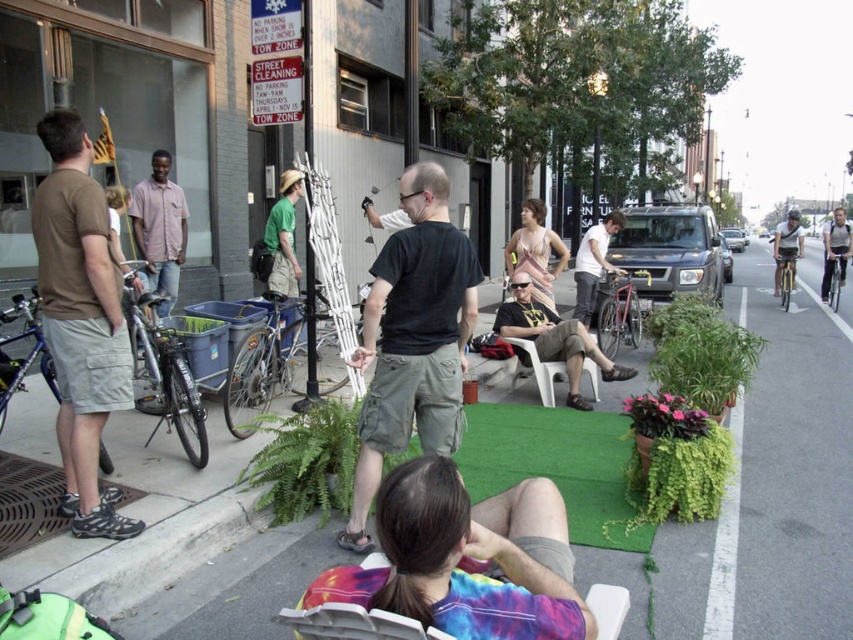
Question: Estimate the real-world distances between objects in this image. Which object is closer to the pink shirt at center?

Choices:
 (A) matte black t-shirt at center
 (B) white plastic chair at center
 (C) brown cotton t-shirt at left

Answer: (C)

Question: Can you confirm if green artificial turf at center is thinner than black cotton shirt at center?

Choices:
 (A) yes
 (B) no

Answer: (B)

Question: Which object is the farthest from the green artificial turf at center?

Choices:
 (A) black cotton shirt at center
 (B) tie-dye fabric at lower center

Answer: (A)

Question: Considering the relative positions of black cotton shirt at center and brown cotton t-shirt at left in the image provided, where is black cotton shirt at center located with respect to brown cotton t-shirt at left?

Choices:
 (A) below
 (B) above

Answer: (A)

Question: Which object is farther from the camera taking this photo?

Choices:
 (A) green artificial turf at center
 (B) light blue jeans at right
 (C) pink shirt at center
 (D) brown cotton t-shirt at left

Answer: (B)

Question: In this image, where is green artificial turf at center located relative to pink shirt at center?

Choices:
 (A) above
 (B) below

Answer: (B)